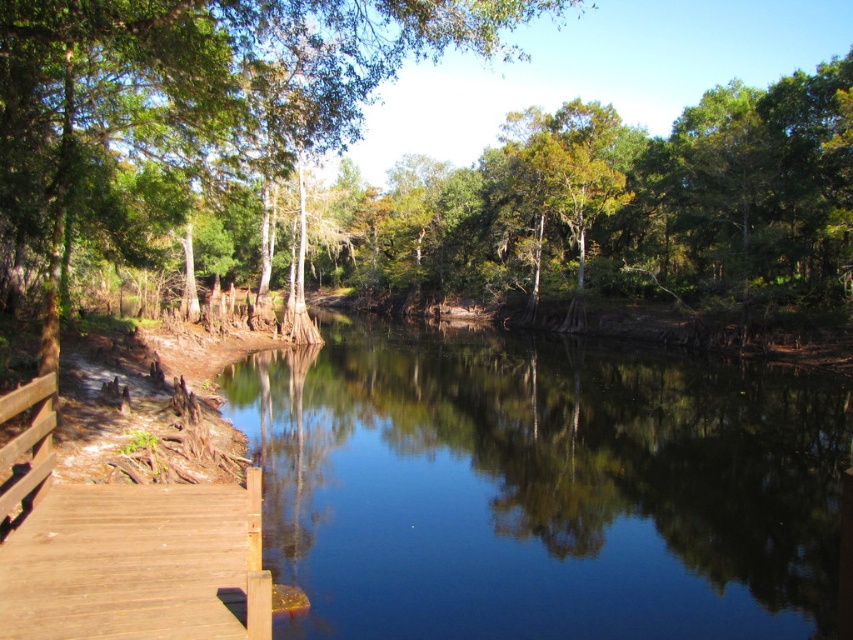
You are planning to build a small boat that is 1.5 meters wide. You want to navigate it from the end of the brown wooden dock at lower left to the center of the clear water at center. Based on the scene description, will your boat fit through the space between the dock and the center of the water?

The clear water at center has a width larger than the brown wooden dock at lower left. Since the boat is 1.5 meters wide, and the water at center is wider than the dock, it should have sufficient space to navigate through the area.

You are standing on the brown wooden dock at lower left and want to take a photo of the green leafy tree at center. Since you are on the dock, will the tree be fully visible in your photo without any obstruction?

The brown wooden dock at lower left is behind the green leafy tree at center, so the tree will be visible in your photo without obstruction from the dock.